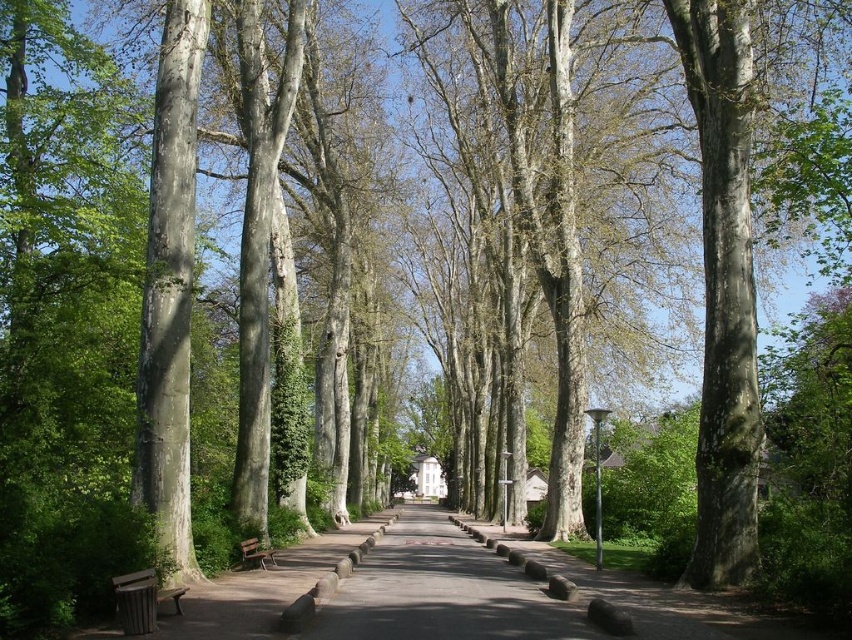
Which of these two, wooden bench at lower left or wooden park bench at center, stands shorter?

Standing shorter between the two is wooden bench at lower left.

What are the coordinates of `wooden bench at lower left` in the screenshot? It's located at (141, 600).